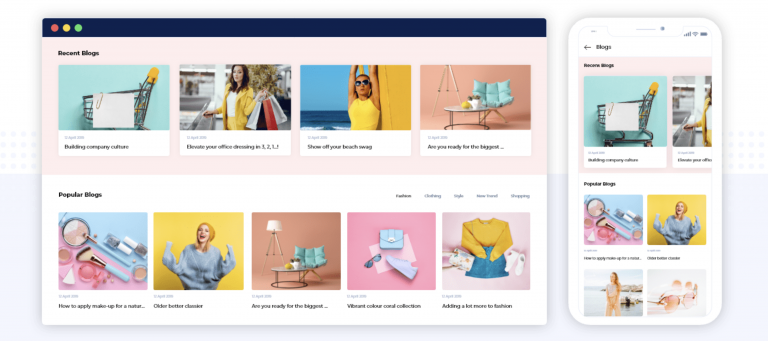
The image size is (768, 341). I want to click on lamp, so click(276, 228).